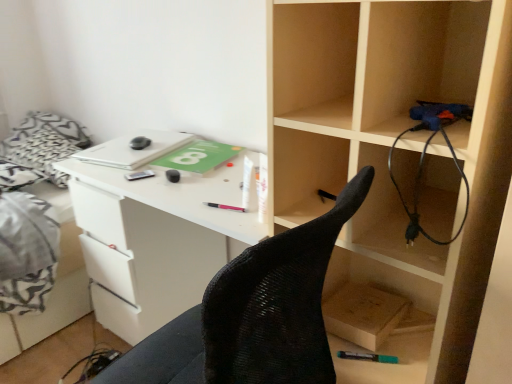
This screenshot has width=512, height=384. Find the location of `free spot to the right of metallic silver pen at center, the fourth stationery when ordered from front to back`. free spot to the right of metallic silver pen at center, the fourth stationery when ordered from front to back is located at coordinates (189, 176).